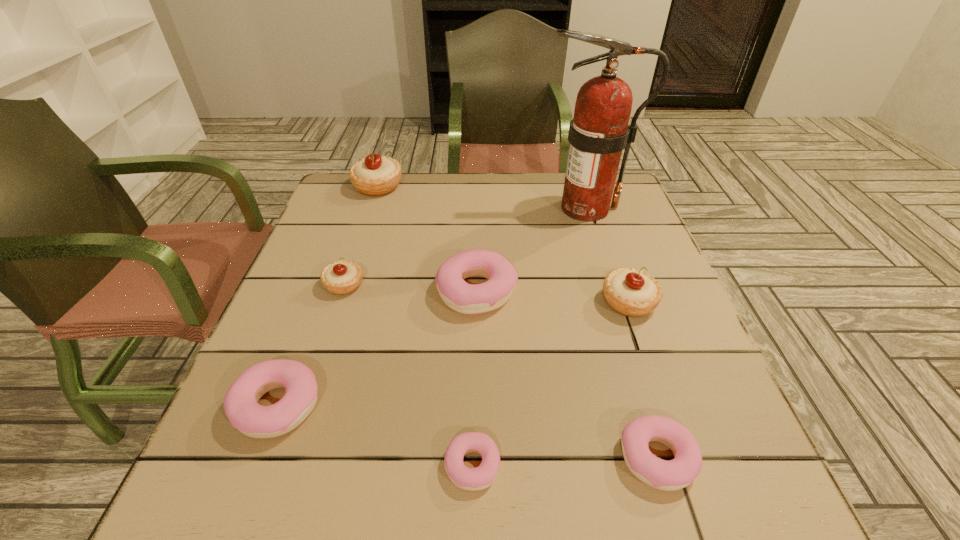
Identify the location of the second shortest pastry. This screenshot has width=960, height=540. (675, 474).

Locate an element on the screen. the second smallest pink pastry is located at coordinates (675, 474).

Where is `the shortest pastry`? The image size is (960, 540). the shortest pastry is located at coordinates (473, 479).

Identify the location of the shortest object. Image resolution: width=960 pixels, height=540 pixels. (473, 479).

The image size is (960, 540). Find the location of `free space located 0.120m at the nozzle of the fire extinguisher`. free space located 0.120m at the nozzle of the fire extinguisher is located at coordinates (495, 208).

Image resolution: width=960 pixels, height=540 pixels. I want to click on vacant position located at the nozzle of the fire extinguisher, so click(427, 208).

Find the location of a particular element. This screenshot has height=540, width=960. vacant position located 0.090m at the nozzle of the fire extinguisher is located at coordinates (506, 208).

Locate an element on the screen. This screenshot has height=540, width=960. blank area located 0.220m on the right of the farthest beige pastry is located at coordinates (477, 186).

The image size is (960, 540). What are the coordinates of `vacant space located on the back of the rightmost beige pastry` in the screenshot? It's located at (595, 207).

Locate an element on the screen. This screenshot has width=960, height=540. free space located 0.320m on the back of the smallest beige pastry is located at coordinates (x=373, y=198).